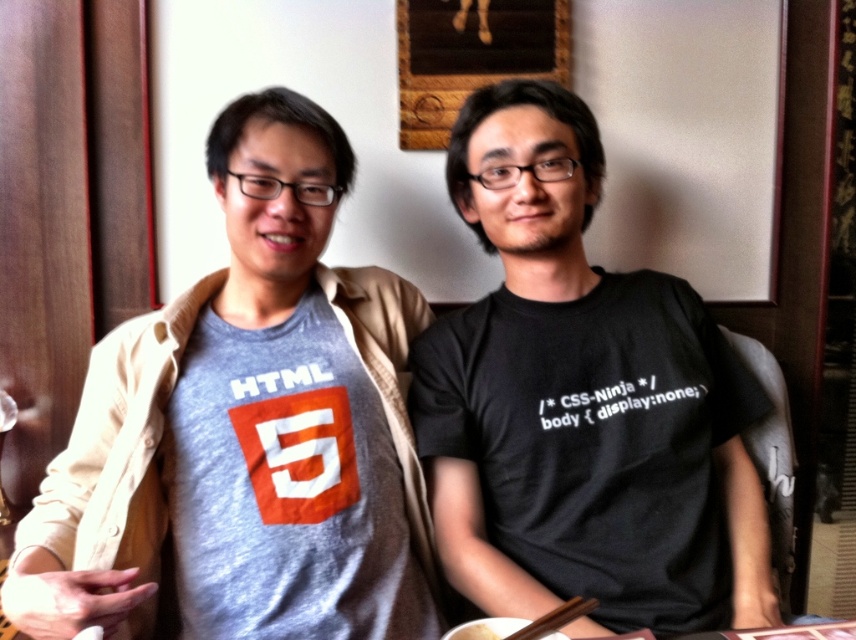
Question: Based on their relative distances, which object is nearer to the white crispy bread at lower center?

Choices:
 (A) gray cotton t-shirt at center
 (B) brown wooden chopsticks at lower center
 (C) black matte t-shirt at center

Answer: (B)

Question: Is gray cotton t-shirt at center thinner than white crispy bread at lower center?

Choices:
 (A) yes
 (B) no

Answer: (B)

Question: Considering the real-world distances, which object is closest to the white crispy bread at lower center?

Choices:
 (A) black matte t-shirt at center
 (B) brown wooden chopsticks at lower center

Answer: (B)

Question: Which object appears farthest from the camera in this image?

Choices:
 (A) gray cotton t-shirt at center
 (B) black matte t-shirt at center
 (C) white crispy bread at lower center

Answer: (B)

Question: Does brown wooden chopsticks at lower center appear over white crispy bread at lower center?

Choices:
 (A) no
 (B) yes

Answer: (B)

Question: Is gray cotton t-shirt at center in front of brown wooden chopsticks at lower center?

Choices:
 (A) yes
 (B) no

Answer: (B)